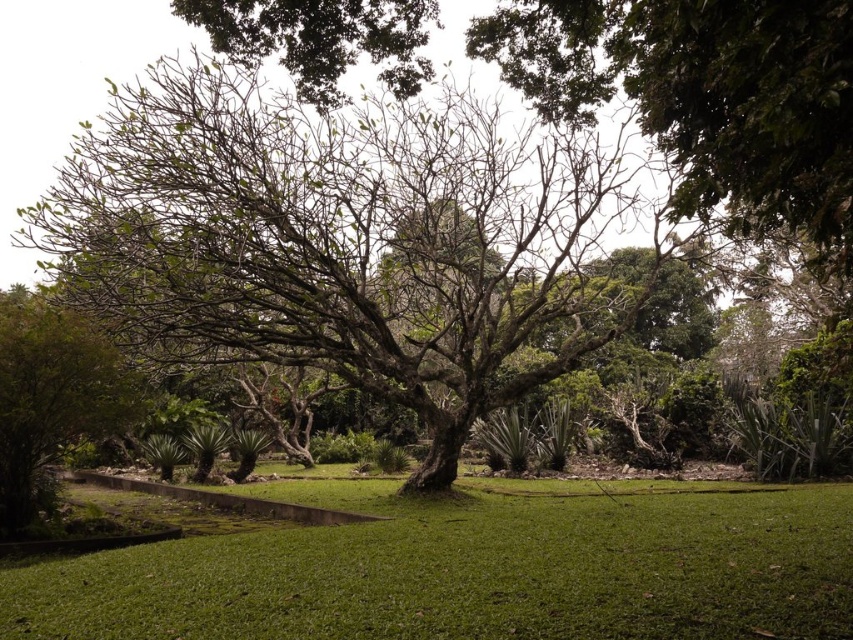
You are a gardener planning to plant a new flower bed in the garden. The flower bed requires an area that is not overshadowed by the green leafy tree at center. Based on the scene, can you determine if the green grass at center is a suitable location for the flower bed?

The green leafy tree at center is bigger than the green grass at center, which means the tree likely casts a larger shadow. Therefore, the green grass at center might be overshadowed by the tree, making it unsuitable for the flower bed that requires sunlight.

You are standing in the garden and want to walk towards the green grass at center. Which direction should you move relative to the green leafy tree at center?

You should move to the right side of the green leafy tree at center to reach the green grass at center since the green leafy tree at center is positioned on the left side of green grass at center.

You are a gardener who wants to plant a new flower bed. You have a limited space between the green leafy tree at center and the green grass at center. Which area would you choose to plant the flowers so they can get enough sunlight?

The green grass at center is shorter than the green leafy tree at center, so planting flowers in the area near the green grass at center would allow them to receive more sunlight since they are not overshadowed by the taller tree.